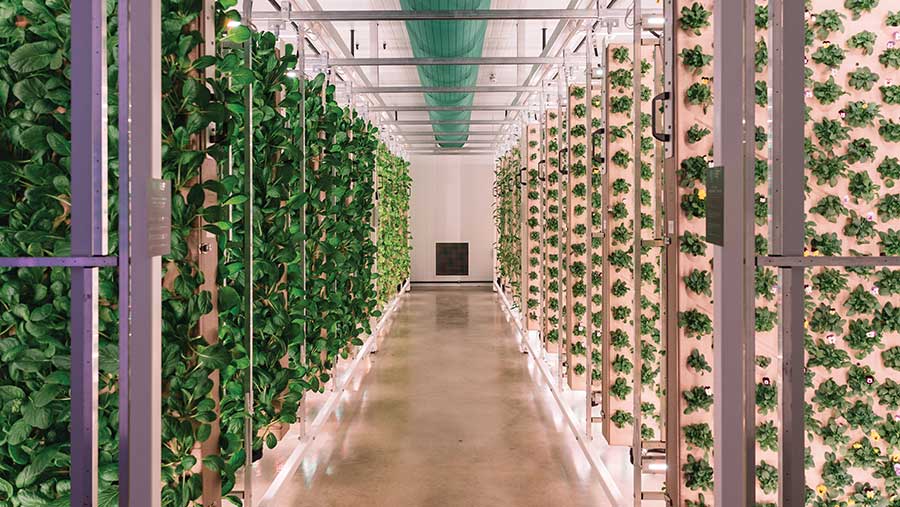
The height and width of the screenshot is (507, 900). Identify the location of hallway. (446, 196).